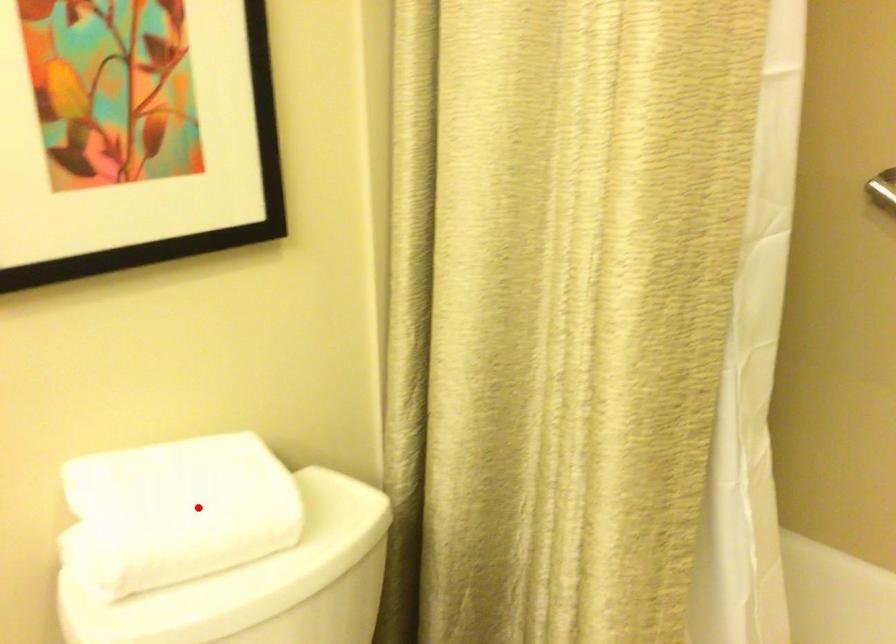
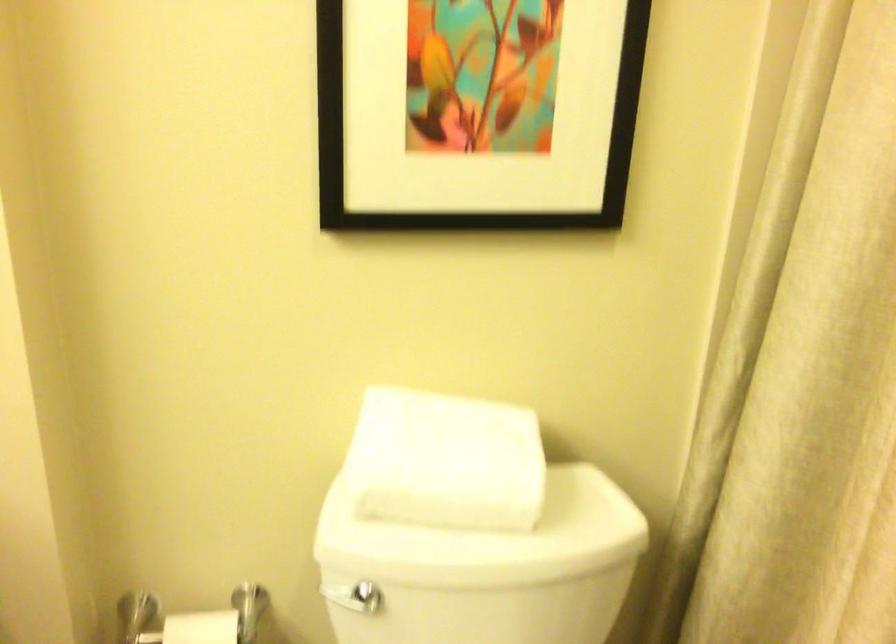
Where in the second image is the point corresponding to the highlighted location from the first image?

(445, 460)